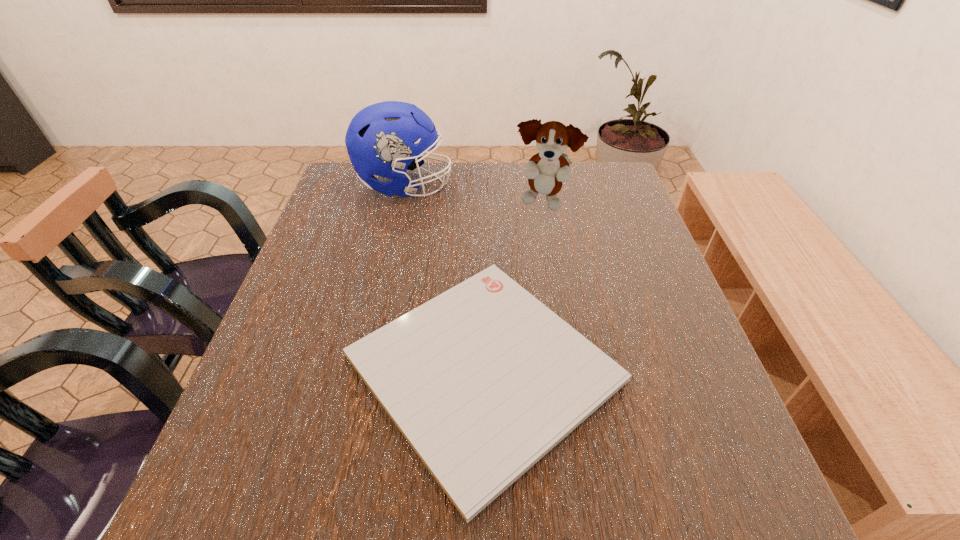
Locate an element on the screen. object at the left edge is located at coordinates (380, 140).

This screenshot has height=540, width=960. Identify the location of object located at the right edge. click(483, 380).

Image resolution: width=960 pixels, height=540 pixels. I want to click on object situated at the far left corner, so click(380, 140).

The width and height of the screenshot is (960, 540). I want to click on object at the near right corner, so click(x=483, y=380).

Locate an element on the screen. The width and height of the screenshot is (960, 540). vacant point at the far edge is located at coordinates (463, 173).

Where is `vacant space at the left edge of the desktop`? This screenshot has width=960, height=540. vacant space at the left edge of the desktop is located at coordinates [279, 317].

The width and height of the screenshot is (960, 540). Identify the location of vacant space at the right edge. (668, 455).

I want to click on blank space at the far left corner of the desktop, so click(361, 190).

Where is `vacant space that is in between the football helmet and the shortest object`? The width and height of the screenshot is (960, 540). vacant space that is in between the football helmet and the shortest object is located at coordinates (444, 276).

I want to click on empty space that is in between the puppy and the football helmet, so click(x=473, y=194).